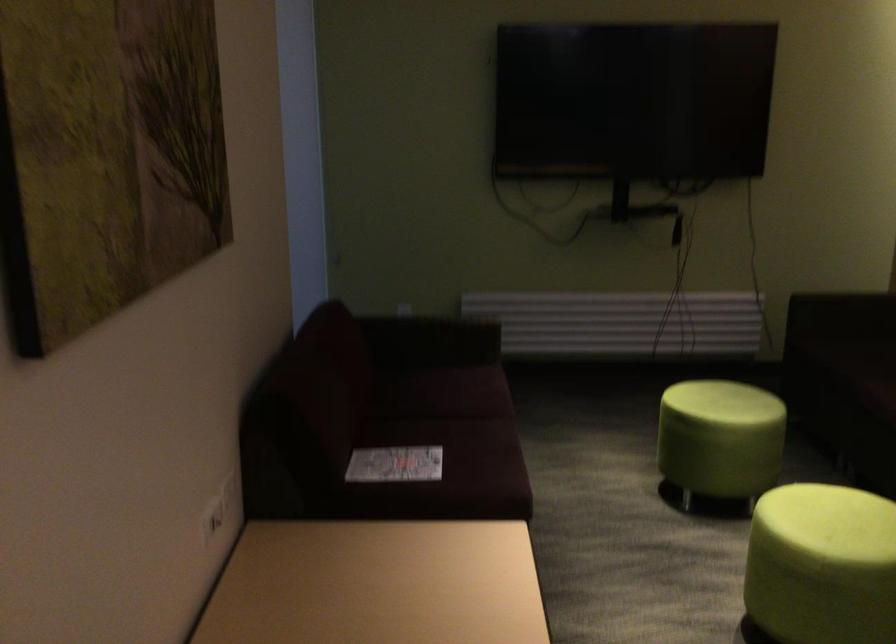
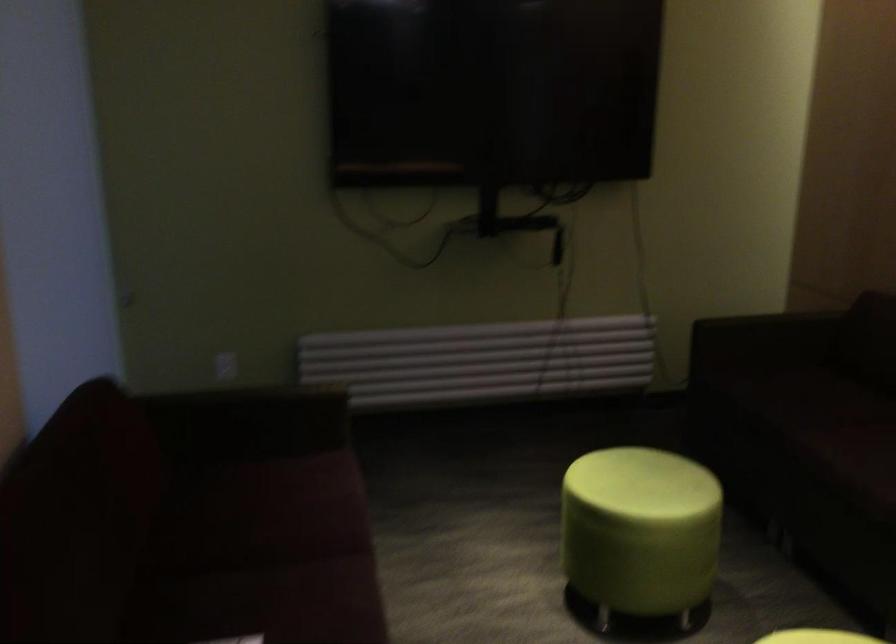
Question: Based on the continuous images, in which direction is the camera rotating? Reply with the corresponding letter.

Choices:
 (A) Left
 (B) Right
 (C) Up
 (D) Down

Answer: (B)